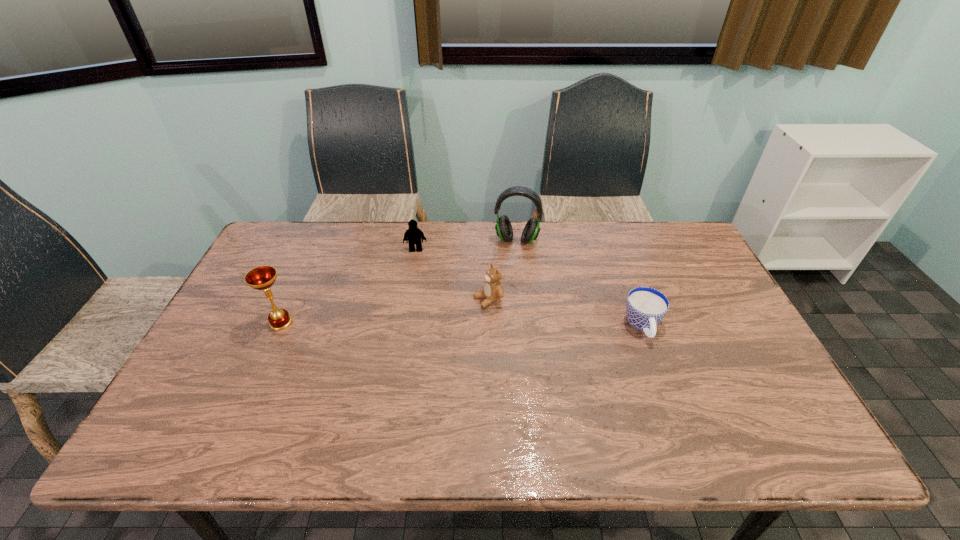
Where is `free space located 0.090m on the front-facing side of the teddy bear`? The width and height of the screenshot is (960, 540). free space located 0.090m on the front-facing side of the teddy bear is located at coordinates (447, 315).

You are a GUI agent. You are given a task and a screenshot of the screen. Output one action in this format:
    pyautogui.click(x=<x>, y=<y>)
    Task: Click on the blank area located 0.300m on the face of the second object from left to right
    This screenshot has height=540, width=960.
    Given the screenshot: What is the action you would take?
    pyautogui.click(x=416, y=319)

Where is `vacant space located 0.170m on the face of the second object from left to right`? The image size is (960, 540). vacant space located 0.170m on the face of the second object from left to right is located at coordinates (416, 287).

This screenshot has width=960, height=540. Identify the location of vacant space situated on the face of the second object from left to right. (416, 281).

Find the location of a particular element. The height and width of the screenshot is (540, 960). vacant space located 0.150m on the ear cups of the headset is located at coordinates (510, 280).

Image resolution: width=960 pixels, height=540 pixels. I want to click on free space located on the ear cups of the headset, so click(x=508, y=293).

Where is `vacant region located 0.260m on the ear cups of the headset`? vacant region located 0.260m on the ear cups of the headset is located at coordinates (507, 305).

In order to click on Lego that is positioned at the far edge in this screenshot , I will do `click(413, 235)`.

Locate an element on the screen. The width and height of the screenshot is (960, 540). headset at the far edge is located at coordinates (503, 227).

Find the location of a particular element. This screenshot has width=960, height=540. object that is at the left edge is located at coordinates (x=263, y=277).